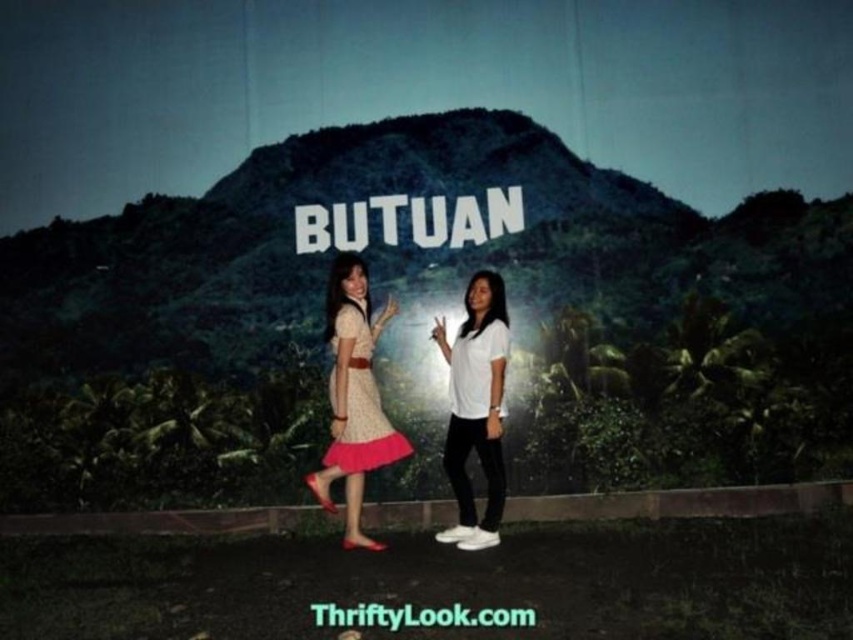
You are a photographer adjusting the camera settings to ensure both the matte white sign at center and the white matte shirt at center are clearly visible. Which object should you focus on first to ensure proper exposure, considering their sizes?

The matte white sign at center is shorter than the white matte shirt at center, so you should focus on the white matte shirt at center first because it is larger and may require more precise exposure adjustments.